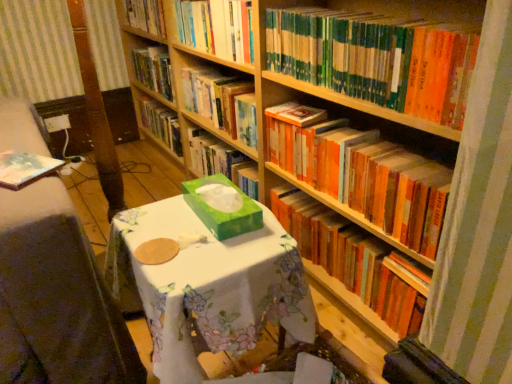
Question: Would you say orange matte bookshelf at upper right, positioned as the 2th book in bottom-to-top order, is inside or outside green matte tissue box at center?

Choices:
 (A) inside
 (B) outside

Answer: (B)

Question: From the image's perspective, is orange matte bookshelf at upper right, marked as the 4th book in a top-to-bottom arrangement, positioned above or below green matte tissue box at center?

Choices:
 (A) below
 (B) above

Answer: (B)

Question: Estimate the real-world distances between objects in this image. Which object is closer to the orange matte bookshelf at center, the 5th book from the top?

Choices:
 (A) orange matte bookshelf at upper right, positioned as the 2th book in bottom-to-top order
 (B) green matte bookshelf at upper right, marked as the 3th book in a bottom-to-top arrangement
 (C) green floral tablecloth at center
 (D) hardcover books at upper center, positioned as the 1th book in top-to-bottom order
 (E) hardcover book at center, which is the second book in top-to-bottom order

Answer: (A)

Question: Estimate the real-world distances between objects in this image. Which object is farther from the orange matte bookshelf at upper right, positioned as the 2th book in bottom-to-top order?

Choices:
 (A) green floral tablecloth at center
 (B) orange matte bookshelf at center, the 5th book from the top
 (C) green matte tissue box at center
 (D) hardcover book at center, acting as the fourth book starting from the bottom
 (E) green matte bookshelf at upper right, which is the 3th book in top-to-bottom order

Answer: (A)